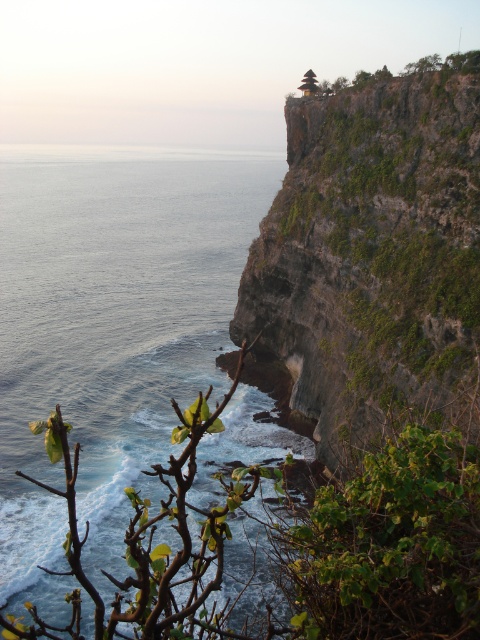
Question: Is blue water at center to the right of green mossy cliff at upper right from the viewer's perspective?

Choices:
 (A) yes
 (B) no

Answer: (B)

Question: Can you confirm if blue water at center is wider than green mossy cliff at upper right?

Choices:
 (A) yes
 (B) no

Answer: (A)

Question: Which of the following is the closest to the observer?

Choices:
 (A) (435, 237)
 (B) (157, 428)

Answer: (A)

Question: Which object is farther from the camera taking this photo?

Choices:
 (A) blue water at center
 (B) green mossy cliff at upper right

Answer: (A)

Question: Which object is closer to the camera taking this photo?

Choices:
 (A) blue water at center
 (B) green mossy cliff at upper right

Answer: (B)

Question: Is blue water at center below green mossy cliff at upper right?

Choices:
 (A) no
 (B) yes

Answer: (A)